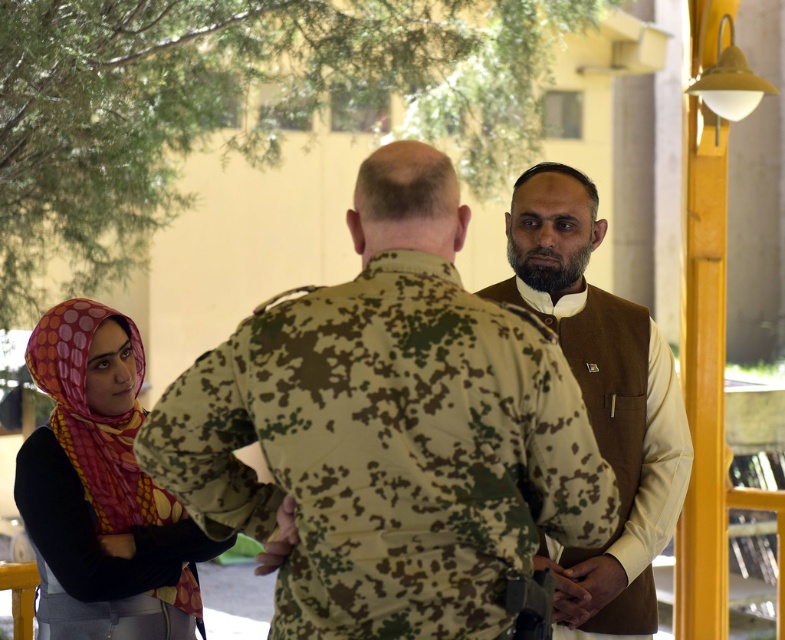
Question: Considering the relative positions of polka dot fabric hijab at lower left and brown textured vest at center in the image provided, where is polka dot fabric hijab at lower left located with respect to brown textured vest at center?

Choices:
 (A) left
 (B) right

Answer: (A)

Question: Which point is closer to the camera?

Choices:
 (A) (634, 429)
 (B) (493, 429)

Answer: (B)

Question: Which point is closer to the camera?

Choices:
 (A) brown textured vest at center
 (B) camouflage uniform at center
 (C) polka dot fabric hijab at lower left

Answer: (B)

Question: Which of the following is the closest to the observer?

Choices:
 (A) polka dot fabric hijab at lower left
 (B) camouflage uniform at center
 (C) brown textured vest at center

Answer: (B)

Question: Is camouflage uniform at center wider than polka dot fabric hijab at lower left?

Choices:
 (A) yes
 (B) no

Answer: (A)

Question: Does polka dot fabric hijab at lower left have a greater width compared to brown textured vest at center?

Choices:
 (A) no
 (B) yes

Answer: (B)